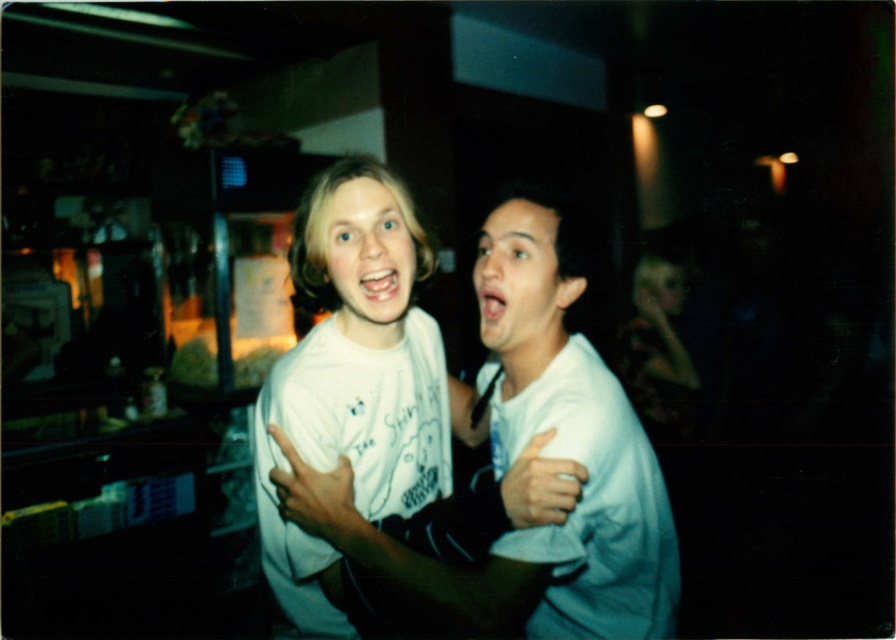
Question: Estimate the real-world distances between objects in this image. Which object is farther from the white matte hand at center?

Choices:
 (A) matte white hand at center
 (B) white cotton t-shirt at right
 (C) white cotton shirt at center
 (D) white matte t-shirt at center

Answer: (D)

Question: Does white cotton t-shirt at right appear under floral fabric dress at right?

Choices:
 (A) yes
 (B) no

Answer: (A)

Question: Estimate the real-world distances between objects in this image. Which object is closer to the white matte hand at center?

Choices:
 (A) white cotton shirt at center
 (B) white cotton t-shirt at right
 (C) matte white hand at center

Answer: (B)

Question: Can you confirm if white cotton shirt at center is positioned to the right of white matte hand at center?

Choices:
 (A) yes
 (B) no

Answer: (B)

Question: Does white cotton shirt at center have a larger size compared to matte white hand at center?

Choices:
 (A) no
 (B) yes

Answer: (B)

Question: Which of these objects is positioned farthest from the white matte t-shirt at center?

Choices:
 (A) white cotton shirt at center
 (B) white matte hand at center
 (C) floral fabric dress at right
 (D) white cotton t-shirt at right

Answer: (C)